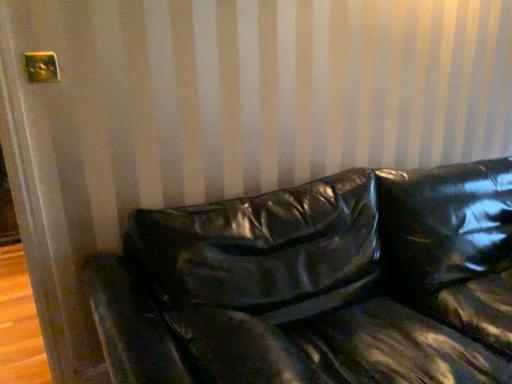
This screenshot has width=512, height=384. I want to click on metallic gold outlet at upper left, so click(41, 67).

This screenshot has width=512, height=384. Describe the element at coordinates (41, 67) in the screenshot. I see `metallic gold outlet at upper left` at that location.

Describe the element at coordinates (318, 284) in the screenshot. I see `glossy black couch at center` at that location.

Identify the location of glossy black couch at center. This screenshot has height=384, width=512. (318, 284).

Identify the location of metallic gold outlet at upper left. Image resolution: width=512 pixels, height=384 pixels. (41, 67).

Does glossy black couch at center appear on the left side of metallic gold outlet at upper left?

No, glossy black couch at center is not to the left of metallic gold outlet at upper left.

In the image, is glossy black couch at center positioned in front of or behind metallic gold outlet at upper left?

Visually, glossy black couch at center is located in front of metallic gold outlet at upper left.

Considering the positions of point (269, 247) and point (34, 61), is point (269, 247) closer or farther from the camera than point (34, 61)?

Point (269, 247) is positioned farther from the camera compared to point (34, 61).

Looking at this image, from the image's perspective, between glossy black couch at center and metallic gold outlet at upper left, which one is located above?

From the image's view, metallic gold outlet at upper left is above.

From a real-world perspective, does glossy black couch at center stand above metallic gold outlet at upper left?

No, from a real-world perspective, glossy black couch at center is not on top of metallic gold outlet at upper left.

Considering the relative sizes of glossy black couch at center and metallic gold outlet at upper left in the image provided, is glossy black couch at center thinner than metallic gold outlet at upper left?

No.

Is glossy black couch at center taller or shorter than metallic gold outlet at upper left?

glossy black couch at center is taller than metallic gold outlet at upper left.

Which of these two, glossy black couch at center or metallic gold outlet at upper left, is smaller?

Smaller between the two is metallic gold outlet at upper left.

Is glossy black couch at center positioned beyond the bounds of metallic gold outlet at upper left?

Yes.

Is glossy black couch at center placed right next to metallic gold outlet at upper left?

They are not placed beside each other.

Is glossy black couch at center turned away from metallic gold outlet at upper left?

That's not correct — glossy black couch at center is not looking away from metallic gold outlet at upper left.

How different are the orientations of glossy black couch at center and metallic gold outlet at upper left in degrees?

glossy black couch at center and metallic gold outlet at upper left are facing 0.593 degrees away from each other.

How much distance is there between glossy black couch at center and metallic gold outlet at upper left?

glossy black couch at center and metallic gold outlet at upper left are 4.00 feet apart.

The image size is (512, 384). Find the location of `studio couch below the metallic gold outlet at upper left (from the image's perspective)`. studio couch below the metallic gold outlet at upper left (from the image's perspective) is located at coordinates (318, 284).

Which object is positioned more to the left, metallic gold outlet at upper left or glossy black couch at center?

metallic gold outlet at upper left is more to the left.

Which is in front, metallic gold outlet at upper left or glossy black couch at center?

glossy black couch at center is in front.

Is point (50, 64) closer to camera compared to point (275, 210)?

Yes, it is in front of point (275, 210).

From the image's perspective, who appears lower, metallic gold outlet at upper left or glossy black couch at center?

glossy black couch at center, from the image's perspective.

From a real-world perspective, which object rests below the other?

glossy black couch at center.

Considering the relative sizes of metallic gold outlet at upper left and glossy black couch at center in the image provided, is metallic gold outlet at upper left wider than glossy black couch at center?

Incorrect, the width of metallic gold outlet at upper left does not surpass that of glossy black couch at center.

Which of these two, metallic gold outlet at upper left or glossy black couch at center, stands taller?

glossy black couch at center is taller.

Consider the image. Is metallic gold outlet at upper left smaller than glossy black couch at center?

Yes.

Is metallic gold outlet at upper left inside or outside of glossy black couch at center?

metallic gold outlet at upper left lies outside glossy black couch at center.

Looking at this image, is metallic gold outlet at upper left in contact with glossy black couch at center?

metallic gold outlet at upper left and glossy black couch at center are not in contact.

Is metallic gold outlet at upper left facing towards glossy black couch at center?

No, metallic gold outlet at upper left is not oriented towards glossy black couch at center.

Can you tell me how much metallic gold outlet at upper left and glossy black couch at center differ in facing direction?

The angular difference between metallic gold outlet at upper left and glossy black couch at center is 0.593 degrees.

In order to click on studio couch below the metallic gold outlet at upper left (from the image's perspective) in this screenshot , I will do `click(318, 284)`.

This screenshot has width=512, height=384. Find the location of `studio couch below the metallic gold outlet at upper left (from the image's perspective)`. studio couch below the metallic gold outlet at upper left (from the image's perspective) is located at coordinates (318, 284).

At what (x,y) coordinates should I click in order to perform the action: click on electric outlet positioned vertically above the glossy black couch at center (from a real-world perspective). Please return your answer as a coordinate pair (x, y). The width and height of the screenshot is (512, 384). Looking at the image, I should click on (41, 67).